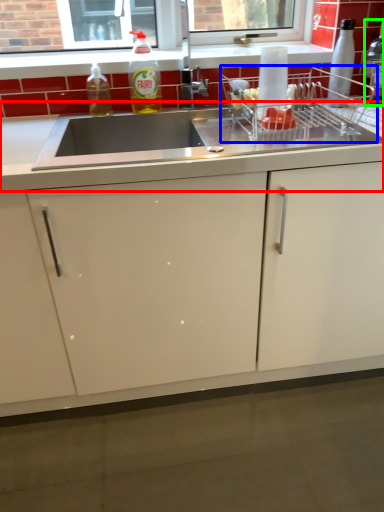
Question: Considering the real-world distances, which object is closest to countertop (highlighted by a red box)? appliance (highlighted by a blue box) or bottle (highlighted by a green box).

Choices:
 (A) appliance
 (B) bottle

Answer: (A)